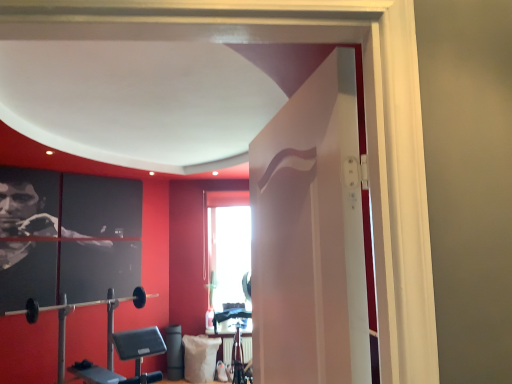
Question: Would you say white fabric pillow at lower center is inside or outside black rubber barbell at lower left?

Choices:
 (A) inside
 (B) outside

Answer: (B)

Question: From a real-world perspective, is white fabric pillow at lower center positioned above or below black rubber barbell at lower left?

Choices:
 (A) above
 (B) below

Answer: (B)

Question: Estimate the real-world distances between objects in this image. Which object is farther from the white fabric pillow at lower center?

Choices:
 (A) white glossy door at center
 (B) black rubber barbell at lower left

Answer: (A)

Question: Which of these objects is positioned closest to the white fabric pillow at lower center?

Choices:
 (A) black rubber barbell at lower left
 (B) white glossy door at center

Answer: (A)